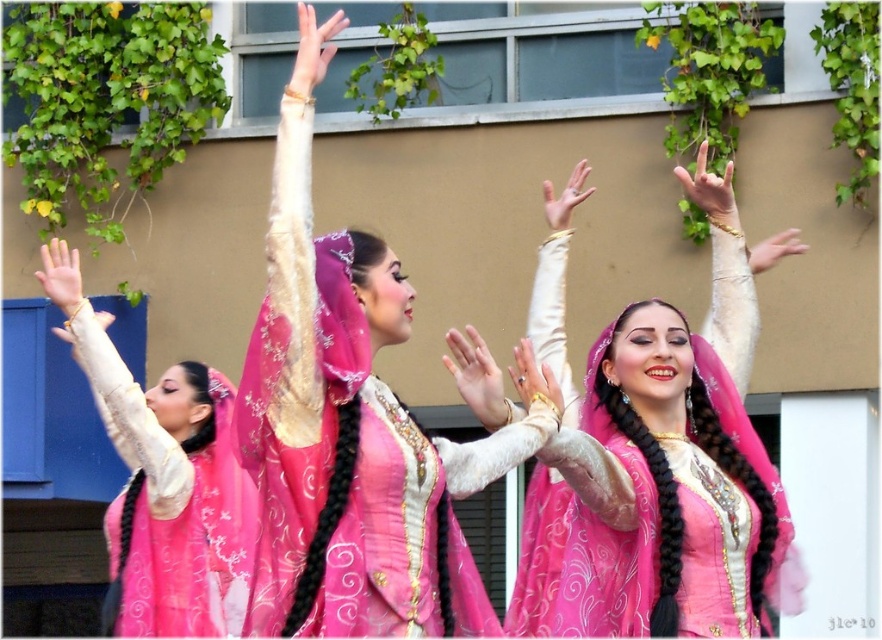
You are a photographer trying to capture the dancers. You notice the matte pink dress at center and the matte gold hand at left. Which object is positioned to the right of the other?

The matte pink dress at center is to the right of the matte gold hand at left.

You are a photographer capturing the dancers. You notice the matte gold bracelet at upper center and the smooth cream hand at upper center in your frame. Which object is positioned lower in the image?

The matte gold bracelet at upper center is located below the smooth cream hand at upper center, so it is positioned lower in the image.

You are a photographer aiming to capture the dancers in the scene. You want to ensure that both the gold metallic ring at center and the matte gold bracelet at upper right are clearly visible in your photo. Based on their sizes, which object might require you to zoom in more to ensure it is captured in detail?

The gold metallic ring at center has a lesser width compared to the matte gold bracelet at upper right, so you might need to zoom in more to capture the gold metallic ring at center in detail.